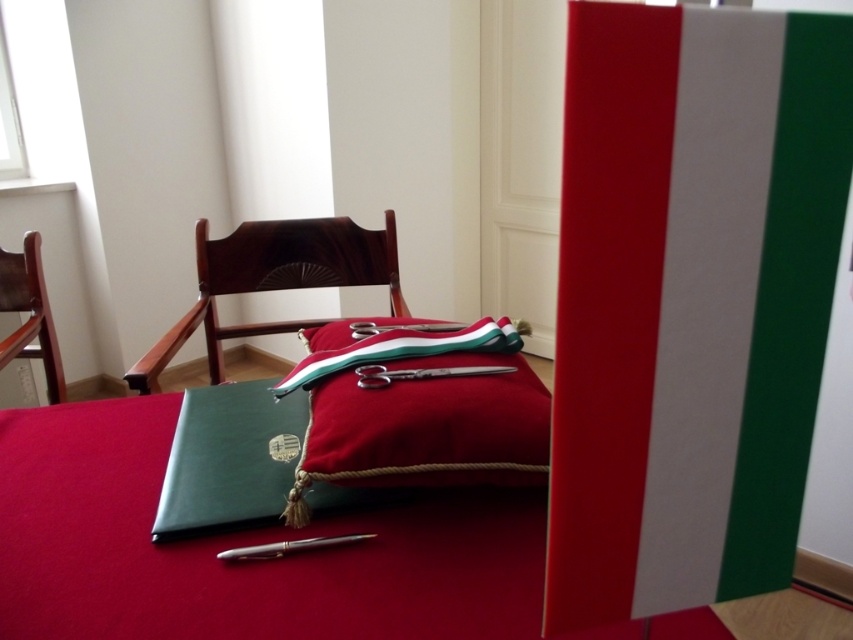
The height and width of the screenshot is (640, 853). I want to click on mahogany wood rocking chair at center, so click(x=273, y=280).

Who is more forward, (352, 276) or (48, 358)?

Point (48, 358) is in front.

Where is `mahogany wood rocking chair at center`? Image resolution: width=853 pixels, height=640 pixels. mahogany wood rocking chair at center is located at coordinates (273, 280).

Which is in front, point (407, 355) or point (315, 538)?

Positioned in front is point (315, 538).

Between point (502, 326) and point (360, 538), which one is positioned behind?

Positioned behind is point (502, 326).

The height and width of the screenshot is (640, 853). What are the coordinates of `velvet red cushion at center` in the screenshot? It's located at (401, 349).

Who is shorter, velvet red pillow at center or silver metallic pen at lower center?

Standing shorter between the two is silver metallic pen at lower center.

Is velvet red pillow at center to the left of silver metallic pen at lower center from the viewer's perspective?

Incorrect, velvet red pillow at center is not on the left side of silver metallic pen at lower center.

Looking at this image, who is more distant from viewer, (444, 435) or (242, 557)?

Positioned behind is point (444, 435).

This screenshot has width=853, height=640. What are the coordinates of `velvet red pillow at center` in the screenshot? It's located at (425, 429).